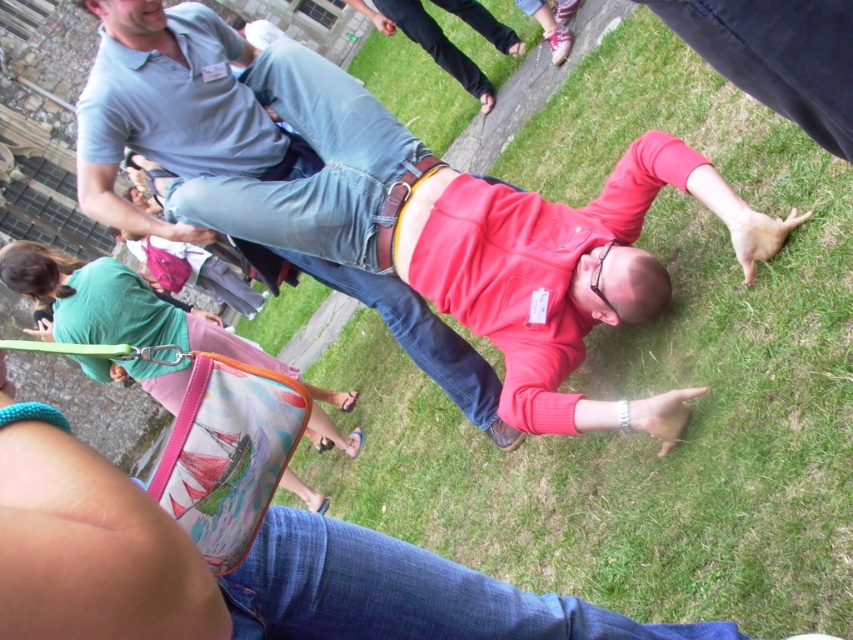
Question: Which point is closer to the camera?

Choices:
 (A) [297, 540]
 (B) [178, 332]

Answer: (A)

Question: Can you confirm if matte red sweater at center is positioned to the left of matte green shirt at lower left?

Choices:
 (A) no
 (B) yes

Answer: (A)

Question: Does matte red sweater at center appear under matte green shirt at lower left?

Choices:
 (A) yes
 (B) no

Answer: (A)

Question: Among these objects, which one is farthest from the camera?

Choices:
 (A) matte green shirt at lower left
 (B) matte red sweater at center

Answer: (A)

Question: Is matte red sweater at center positioned behind matte green shirt at lower left?

Choices:
 (A) yes
 (B) no

Answer: (B)